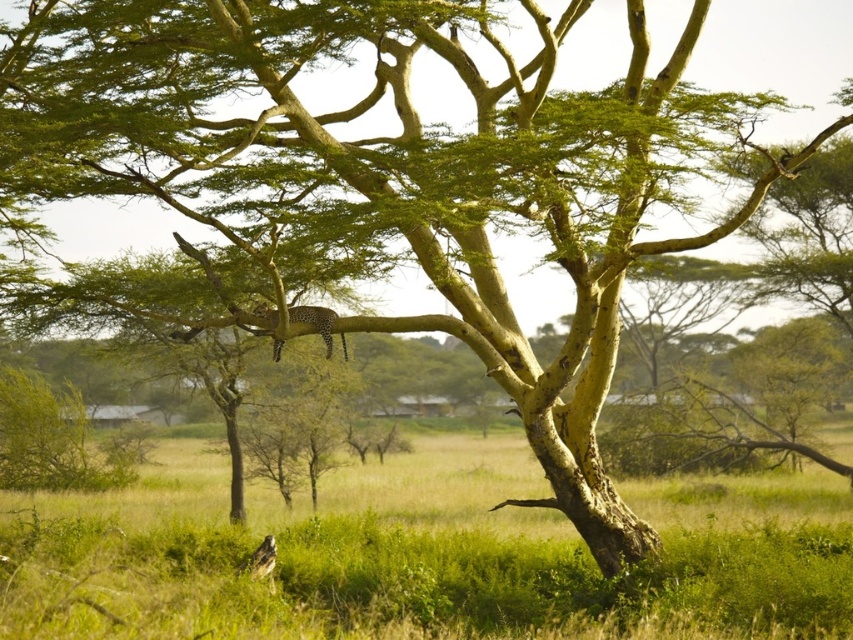
Question: Is spotted fur cheetah at upper center wider than spotted fur leopard at lower left?

Choices:
 (A) yes
 (B) no

Answer: (A)

Question: Where is spotted fur cheetah at upper center located in relation to spotted fur leopard at lower left in the image?

Choices:
 (A) left
 (B) right

Answer: (B)

Question: Which point appears closest to the camera in this image?

Choices:
 (A) (270, 556)
 (B) (292, 320)

Answer: (B)

Question: From the image, what is the correct spatial relationship of spotted fur cheetah at upper center in relation to spotted fur leopard at lower left?

Choices:
 (A) left
 (B) right

Answer: (B)

Question: Which point is farther to the camera?

Choices:
 (A) (265, 544)
 (B) (276, 308)

Answer: (A)